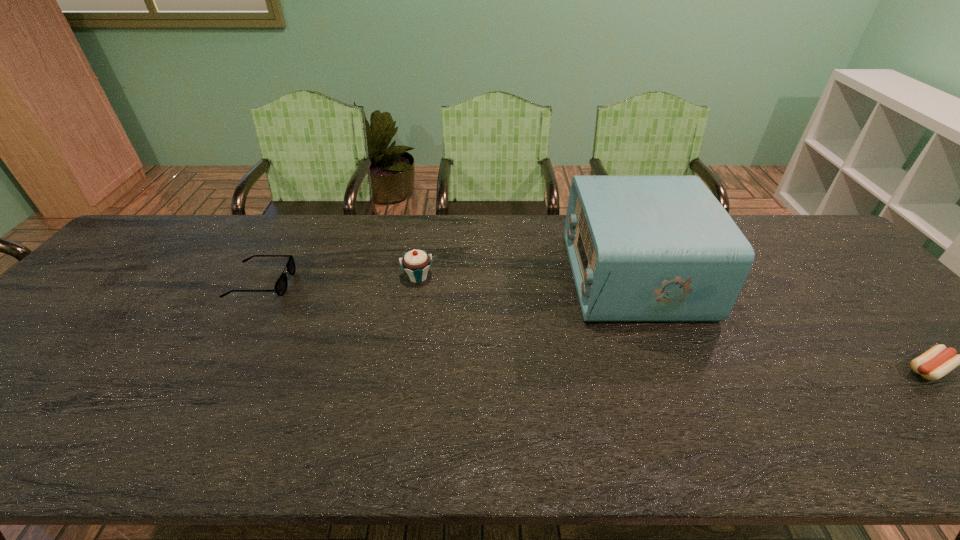
Locate an element on the screen. This screenshot has width=960, height=540. object that is the closest one to the tallest object is located at coordinates (938, 361).

Where is `free space that satisfies the following two spatial constraints: 1. on the front side of the cupcake; 2. on the front-facing side of the spectacles`? Image resolution: width=960 pixels, height=540 pixels. free space that satisfies the following two spatial constraints: 1. on the front side of the cupcake; 2. on the front-facing side of the spectacles is located at coordinates (417, 282).